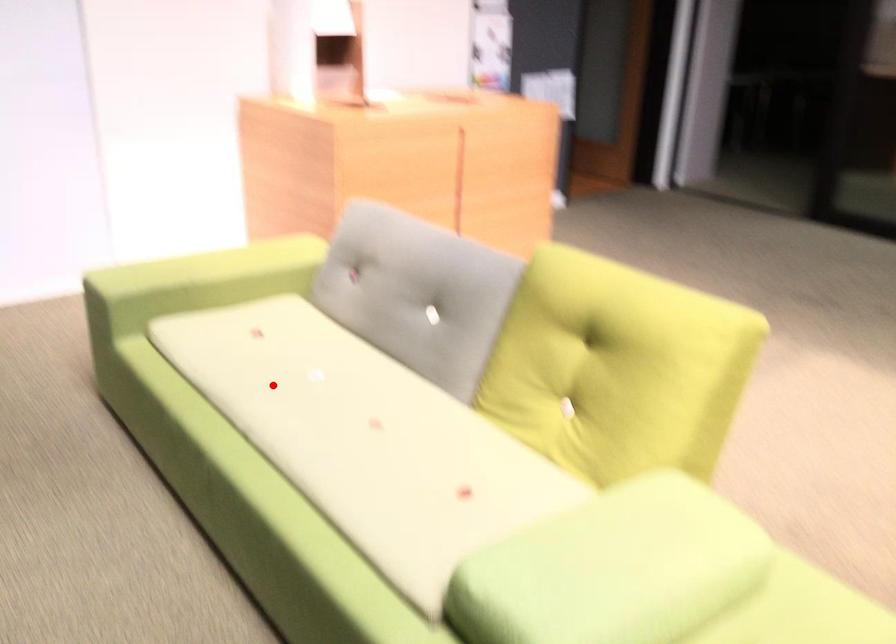
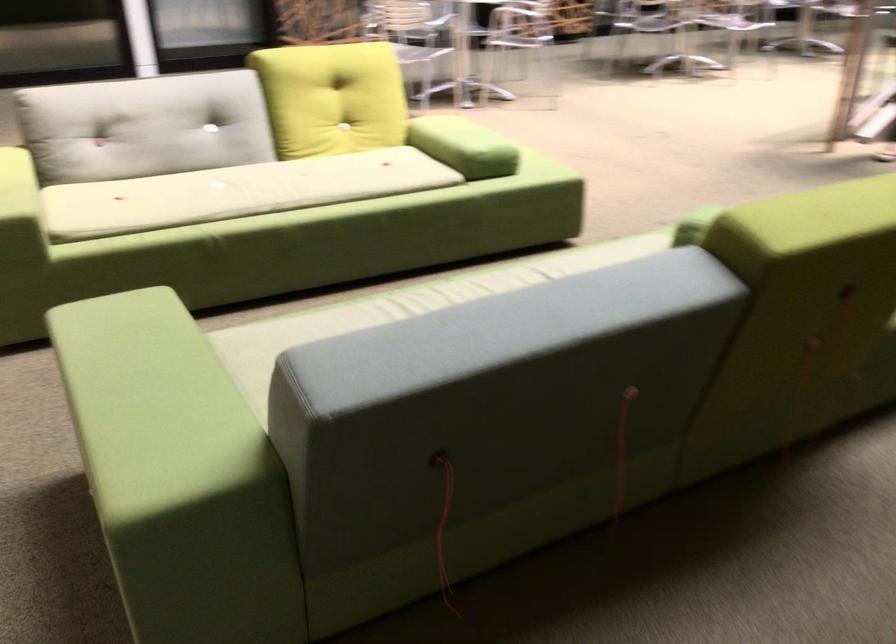
Locate, in the second image, the point that corresponds to the highlighted location in the first image.

(236, 192)